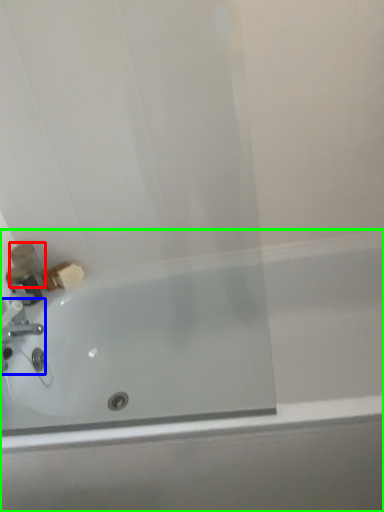
Question: Considering the real-world distances, which object is closest to toiletry (highlighted by a red box)? tap (highlighted by a blue box) or bathtub (highlighted by a green box).

Choices:
 (A) tap
 (B) bathtub

Answer: (A)